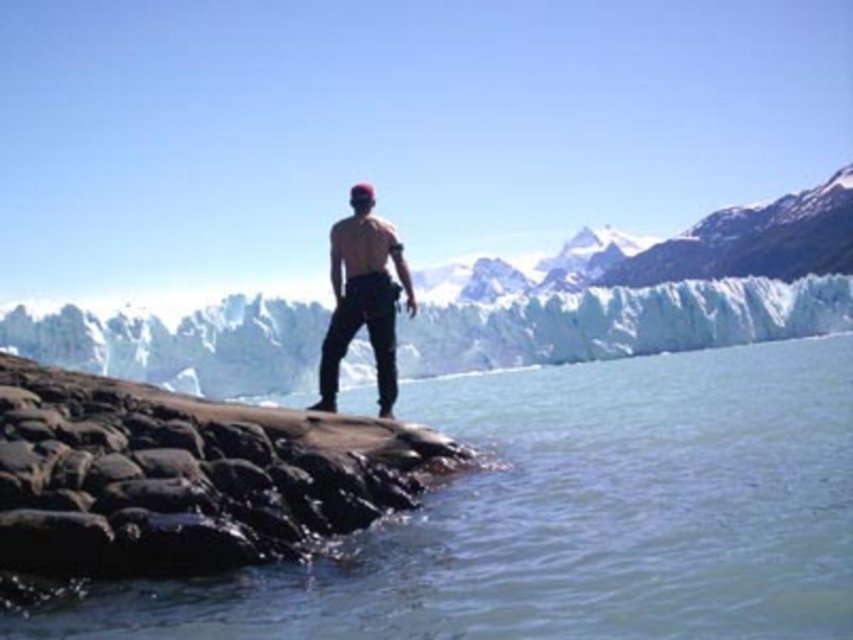
Question: Estimate the real-world distances between objects in this image. Which object is farther from the matte black pants at center?

Choices:
 (A) clear water at rock edge
 (B) rough textured rock at center

Answer: (A)

Question: Among these points, which one is nearest to the camera?

Choices:
 (A) (392, 285)
 (B) (846, 557)

Answer: (B)

Question: From the image, what is the correct spatial relationship of clear water at rock edge in relation to snowy ice glacier at upper center?

Choices:
 (A) left
 (B) right

Answer: (A)

Question: Which object is farther from the camera taking this photo?

Choices:
 (A) clear water at rock edge
 (B) rough textured rock at center

Answer: (B)

Question: Does snowy ice glacier at upper center have a larger size compared to matte black pants at center?

Choices:
 (A) yes
 (B) no

Answer: (A)

Question: Can you confirm if rough textured rock at center is positioned below matte black pants at center?

Choices:
 (A) yes
 (B) no

Answer: (A)